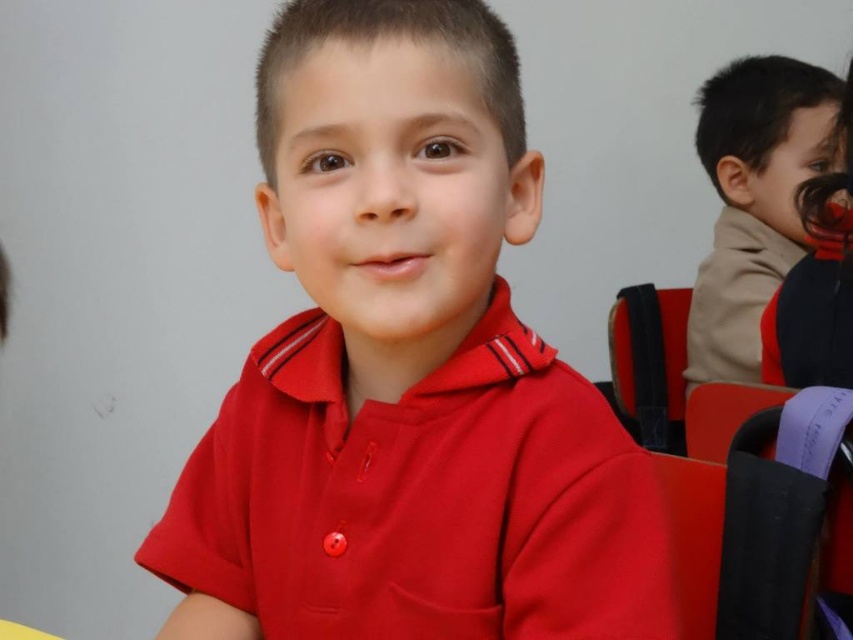
Which of these two, matte red shirt at center or black fabric chair at right, stands taller?

With more height is matte red shirt at center.

Can you confirm if matte red shirt at center is shorter than black fabric chair at right?

No.

At what (x,y) coordinates should I click in order to perform the action: click on matte red shirt at center. Please return your answer as a coordinate pair (x, y). This screenshot has width=853, height=640. Looking at the image, I should click on (405, 372).

Can you confirm if brown fuzzy sweater at upper right is positioned below black fabric chair at right?

No.

Does brown fuzzy sweater at upper right have a greater height compared to black fabric chair at right?

Yes.

Is point (740, 320) closer to viewer compared to point (628, 380)?

Yes, point (740, 320) is closer to viewer.

Image resolution: width=853 pixels, height=640 pixels. In order to click on brown fuzzy sweater at upper right in this screenshot , I will do `click(753, 202)`.

Can you confirm if matte red shirt at center is shorter than brown fuzzy sweater at upper right?

Yes.

Is matte red shirt at center to the left of brown fuzzy sweater at upper right from the viewer's perspective?

Correct, you'll find matte red shirt at center to the left of brown fuzzy sweater at upper right.

You are a GUI agent. You are given a task and a screenshot of the screen. Output one action in this format:
    pyautogui.click(x=<x>, y=<y>)
    Task: Click on the matte red shirt at center
    The image size is (853, 640).
    Given the screenshot: What is the action you would take?
    pyautogui.click(x=405, y=372)